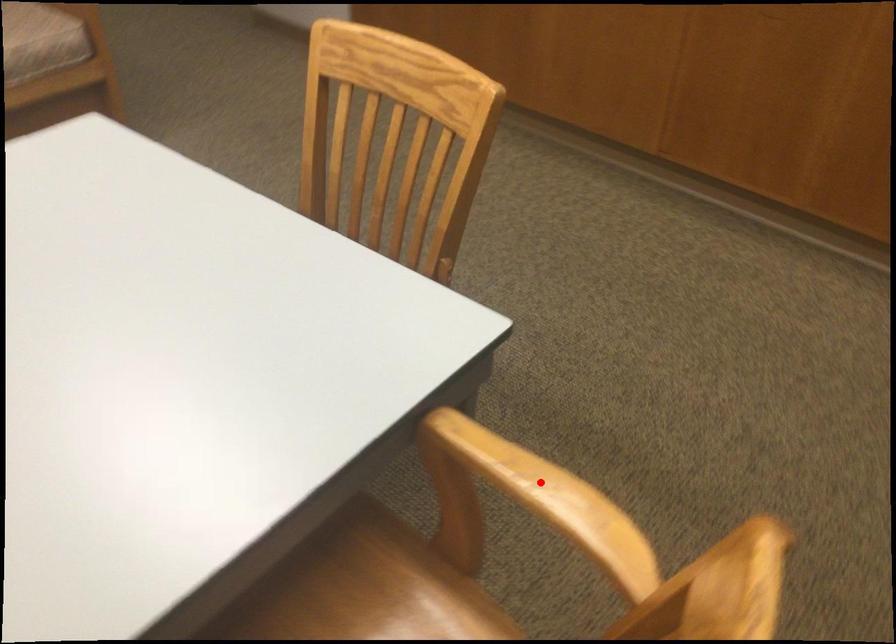
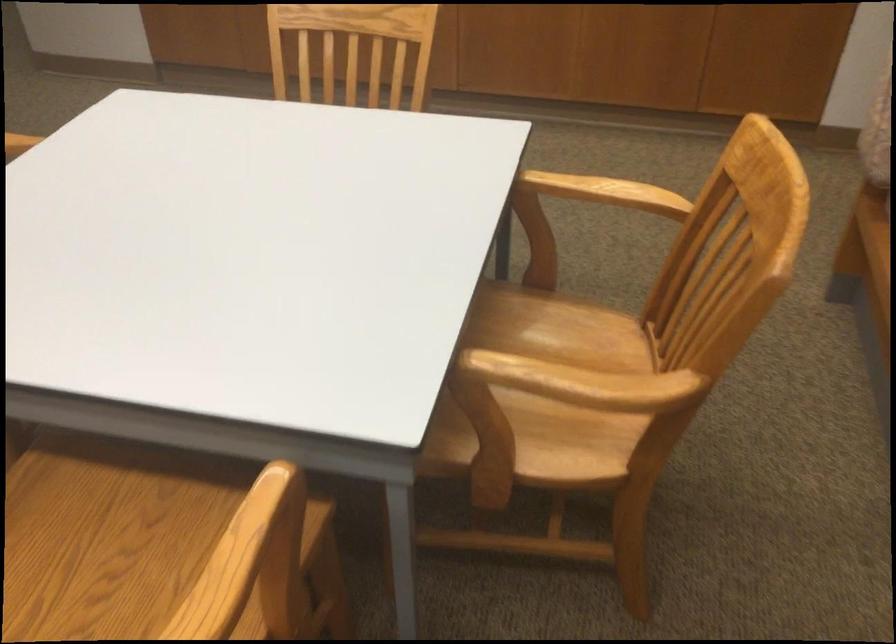
Find the pixel in the second image that matches the highlighted location in the first image.

(605, 192)